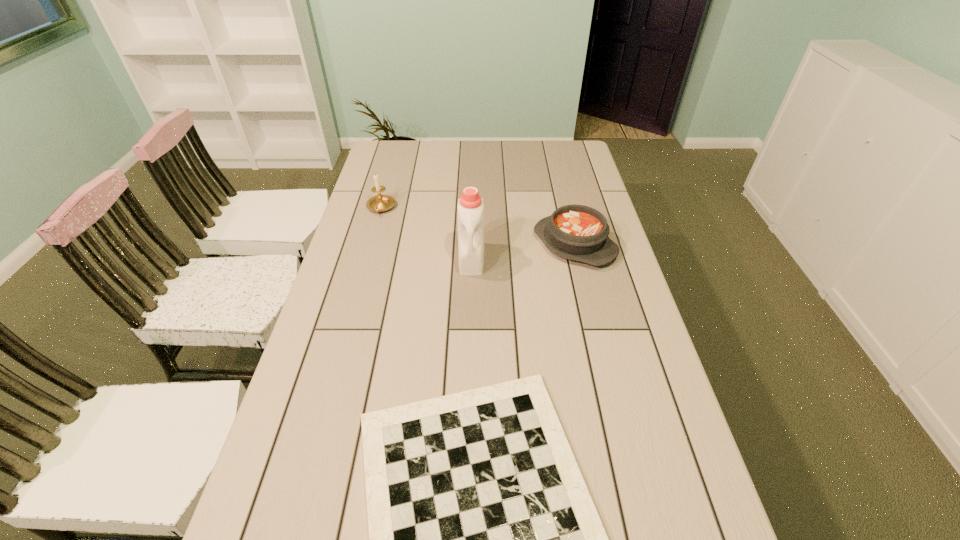
The height and width of the screenshot is (540, 960). I want to click on vacant region at the right edge of the desktop, so click(629, 313).

This screenshot has height=540, width=960. Identify the location of free space at the far left corner of the desktop. (398, 150).

This screenshot has width=960, height=540. Find the location of `unoccupied position between the farthest object and the detergent`. unoccupied position between the farthest object and the detergent is located at coordinates (426, 233).

Find the location of a particular element. This screenshot has height=540, width=960. empty location between the casserole and the detergent is located at coordinates (523, 252).

Locate an element on the screen. free spot between the second shortest object and the detergent is located at coordinates pos(523,252).

Identify the location of vacant space that's between the detergent and the third tallest object. (523, 252).

Where is `free spot between the detergent and the farthest object`? Image resolution: width=960 pixels, height=540 pixels. free spot between the detergent and the farthest object is located at coordinates (426, 233).

What are the coordinates of `the third closest object to the farthest object` in the screenshot? It's located at (483, 538).

This screenshot has width=960, height=540. Find the location of `the third closest object to the tallest object`. the third closest object to the tallest object is located at coordinates (483, 538).

At what (x,y) coordinates should I click in order to perform the action: click on vacant space that satisfies the following two spatial constraints: 1. with a handle on the side of the leftmost object; 2. on the left side of the second shortest object. Please return your answer as a coordinate pair (x, y). Looking at the image, I should click on (371, 244).